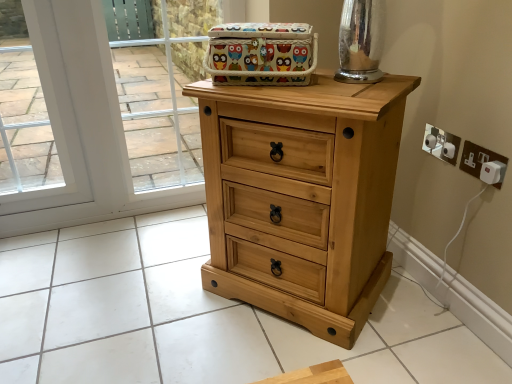
What is the approximate height of white plastic electrical outlet at right, which is counted as the second electric outlet, starting from the back?

white plastic electrical outlet at right, which is counted as the second electric outlet, starting from the back, is 3.96 inches tall.

What do you see at coordinates (305, 194) in the screenshot? I see `natural wood chest of drawers at center` at bounding box center [305, 194].

Where is `transparent glass door at upper left`? The width and height of the screenshot is (512, 384). transparent glass door at upper left is located at coordinates (81, 128).

Locate an element on the screen. The height and width of the screenshot is (384, 512). owl-patterned fabric basket at upper center is located at coordinates (261, 54).

Find the location of `white plastic electrical outlet at right, which is counted as the second electric outlet, starting from the back`. white plastic electrical outlet at right, which is counted as the second electric outlet, starting from the back is located at coordinates (482, 162).

Can you confirm if white plastic electrical outlet at right, positioned as the first electric outlet in front-to-back order, is thinner than owl-patterned fabric basket at upper center?

Yes.

Is white plastic electrical outlet at right, which is counted as the second electric outlet, starting from the back, facing away from owl-patterned fabric basket at upper center?

No.

Considering the relative sizes of white plastic electrical outlet at right, which is counted as the second electric outlet, starting from the back, and owl-patterned fabric basket at upper center in the image provided, is white plastic electrical outlet at right, which is counted as the second electric outlet, starting from the back, taller than owl-patterned fabric basket at upper center?

Incorrect, the height of white plastic electrical outlet at right, which is counted as the second electric outlet, starting from the back, is not larger of that of owl-patterned fabric basket at upper center.

Can you confirm if brushed metal knob at center, the 2th knob in the back-to-front sequence, is thinner than brushed metal knob at upper right, which appears as the first knob when viewed from the back?

Indeed, brushed metal knob at center, the 2th knob in the back-to-front sequence, has a lesser width compared to brushed metal knob at upper right, which appears as the first knob when viewed from the back.

From the image's perspective, is brushed metal knob at center, which ranks as the first knob in front-to-back order, located above or below brushed metal knob at upper right, which ranks as the second knob in front-to-back order?

Based on their image positions, brushed metal knob at center, which ranks as the first knob in front-to-back order, is located beneath brushed metal knob at upper right, which ranks as the second knob in front-to-back order.

Is brushed metal knob at center, the 2th knob in the back-to-front sequence, with brushed metal knob at upper right, which ranks as the second knob in front-to-back order?

Yes, brushed metal knob at center, the 2th knob in the back-to-front sequence, and brushed metal knob at upper right, which ranks as the second knob in front-to-back order, clearly make contact.

In the scene shown: In terms of size, does natural wood chest of drawers at center appear bigger or smaller than white plastic electric outlet at right, the 2th electric outlet viewed from the front?

natural wood chest of drawers at center is bigger than white plastic electric outlet at right, the 2th electric outlet viewed from the front.

Which is behind, point (228, 194) or point (458, 143)?

The point (458, 143) is behind.

Which of these two, natural wood chest of drawers at center or white plastic electric outlet at right, the 2th electric outlet viewed from the front, stands shorter?

white plastic electric outlet at right, the 2th electric outlet viewed from the front, is shorter.

From a real-world perspective, is natural wood chest of drawers at center physically above white plastic electric outlet at right, positioned as the first electric outlet in back-to-front order?

No, from a real-world perspective, natural wood chest of drawers at center is not on top of white plastic electric outlet at right, positioned as the first electric outlet in back-to-front order.

From the image's perspective, would you say transparent glass door at upper left is positioned over white plastic electrical outlet at right, positioned as the first electric outlet in front-to-back order?

Yes.

Relative to white plastic electrical outlet at right, positioned as the first electric outlet in front-to-back order, is transparent glass door at upper left in front or behind?

In the image, transparent glass door at upper left appears behind white plastic electrical outlet at right, positioned as the first electric outlet in front-to-back order.

Looking at the image, does transparent glass door at upper left seem bigger or smaller compared to white plastic electrical outlet at right, which is counted as the second electric outlet, starting from the back?

Clearly, transparent glass door at upper left is larger in size than white plastic electrical outlet at right, which is counted as the second electric outlet, starting from the back.

Is transparent glass door at upper left far from white plastic electrical outlet at right, which is counted as the second electric outlet, starting from the back?

Yes, transparent glass door at upper left and white plastic electrical outlet at right, which is counted as the second electric outlet, starting from the back, are quite far apart.

Looking at this image, can you tell me how much white plastic electric outlet at right, positioned as the first electric outlet in back-to-front order, and white plastic electrical outlet at right, positioned as the first electric outlet in front-to-back order, differ in facing direction?

They differ by 0.035 degrees in their facing directions.

Which point is more forward, (440, 145) or (467, 162)?

The point (440, 145) is more forward.

Which of these two, white plastic electric outlet at right, the 2th electric outlet viewed from the front, or white plastic electrical outlet at right, which is counted as the second electric outlet, starting from the back, is bigger?

white plastic electrical outlet at right, which is counted as the second electric outlet, starting from the back, is bigger.

Between white plastic electric outlet at right, the 2th electric outlet viewed from the front, and white plastic electrical outlet at right, positioned as the first electric outlet in front-to-back order, which one has less height?

white plastic electrical outlet at right, positioned as the first electric outlet in front-to-back order.

Consider the image. Is brushed metal knob at upper right, which appears as the first knob when viewed from the back, at the back of transparent glass door at upper left?

No, brushed metal knob at upper right, which appears as the first knob when viewed from the back, is not at the back of transparent glass door at upper left.

Find the location of a particular element. knob that is the 1st object located below the transparent glass door at upper left (from the image's perspective) is located at coordinates (430, 141).

Is brushed metal knob at upper right, which ranks as the second knob in front-to-back order, completely or partially inside transparent glass door at upper left?

Actually, brushed metal knob at upper right, which ranks as the second knob in front-to-back order, is outside transparent glass door at upper left.

Is transparent glass door at upper left not near brushed metal knob at upper right, which ranks as the second knob in front-to-back order?

Yes, transparent glass door at upper left and brushed metal knob at upper right, which ranks as the second knob in front-to-back order, are located far from each other.

Could you tell me if brushed metal knob at upper right, which appears as the first knob when viewed from the back, is facing natural wood chest of drawers at center?

Yes, brushed metal knob at upper right, which appears as the first knob when viewed from the back, faces towards natural wood chest of drawers at center.

Considering the sizes of objects brushed metal knob at upper right, which appears as the first knob when viewed from the back, and natural wood chest of drawers at center in the image provided, who is taller, brushed metal knob at upper right, which appears as the first knob when viewed from the back, or natural wood chest of drawers at center?

Standing taller between the two is natural wood chest of drawers at center.

Is brushed metal knob at upper right, which appears as the first knob when viewed from the back, located outside natural wood chest of drawers at center?

brushed metal knob at upper right, which appears as the first knob when viewed from the back, is positioned outside natural wood chest of drawers at center.

Considering the positions of objects brushed metal knob at upper right, which ranks as the second knob in front-to-back order, and natural wood chest of drawers at center in the image provided, who is in front, brushed metal knob at upper right, which ranks as the second knob in front-to-back order, or natural wood chest of drawers at center?

natural wood chest of drawers at center.

This screenshot has width=512, height=384. Find the location of `electric outlet that is the 2nd one when counting rightward from the owl-patterned fabric basket at upper center`. electric outlet that is the 2nd one when counting rightward from the owl-patterned fabric basket at upper center is located at coordinates (482, 162).

Locate an element on the screen. knob that is on the left side of brushed metal knob at center, the 2th knob in the back-to-front sequence is located at coordinates (430, 141).

Which object lies further to the anchor point brushed metal knob at upper right, which appears as the first knob when viewed from the back, transparent glass door at upper left or brushed metal knob at center, which ranks as the first knob in front-to-back order?

Based on the image, transparent glass door at upper left appears to be further to brushed metal knob at upper right, which appears as the first knob when viewed from the back.

Estimate the real-world distances between objects in this image. Which object is closer to transparent glass door at upper left, white plastic electrical outlet at right, positioned as the first electric outlet in front-to-back order, or brushed metal knob at center, which ranks as the first knob in front-to-back order?

brushed metal knob at center, which ranks as the first knob in front-to-back order, is closer to transparent glass door at upper left.

Considering their positions, is owl-patterned fabric basket at upper center positioned further to brushed metal knob at center, the 2th knob in the back-to-front sequence, than white plastic electric outlet at right, positioned as the first electric outlet in back-to-front order?

owl-patterned fabric basket at upper center is further to brushed metal knob at center, the 2th knob in the back-to-front sequence.

From the image, which object appears to be farther from brushed metal knob at upper right, which ranks as the second knob in front-to-back order, natural wood chest of drawers at center or owl-patterned fabric basket at upper center?

Among the two, owl-patterned fabric basket at upper center is located further to brushed metal knob at upper right, which ranks as the second knob in front-to-back order.

Considering their positions, is natural wood chest of drawers at center positioned further to transparent glass door at upper left than brushed metal knob at center, the 2th knob in the back-to-front sequence?

brushed metal knob at center, the 2th knob in the back-to-front sequence, is positioned further to the anchor transparent glass door at upper left.

Looking at the image, which one is located further to white plastic electrical outlet at right, which is counted as the second electric outlet, starting from the back, natural wood chest of drawers at center or transparent glass door at upper left?

transparent glass door at upper left is positioned further to the anchor white plastic electrical outlet at right, which is counted as the second electric outlet, starting from the back.

Estimate the real-world distances between objects in this image. Which object is further from brushed metal knob at center, the 2th knob in the back-to-front sequence, owl-patterned fabric basket at upper center or brushed metal knob at upper right, which ranks as the second knob in front-to-back order?

The object further to brushed metal knob at center, the 2th knob in the back-to-front sequence, is owl-patterned fabric basket at upper center.

Based on their spatial positions, is transparent glass door at upper left or owl-patterned fabric basket at upper center closer to brushed metal knob at upper right, which ranks as the second knob in front-to-back order?

The object closer to brushed metal knob at upper right, which ranks as the second knob in front-to-back order, is owl-patterned fabric basket at upper center.

Where is `electric outlet between transparent glass door at upper left and white plastic electrical outlet at right, which is counted as the second electric outlet, starting from the back, from left to right`? This screenshot has width=512, height=384. electric outlet between transparent glass door at upper left and white plastic electrical outlet at right, which is counted as the second electric outlet, starting from the back, from left to right is located at coordinates (441, 144).

Find the location of a particular element. The width and height of the screenshot is (512, 384). chest of drawers between transparent glass door at upper left and white plastic electrical outlet at right, positioned as the first electric outlet in front-to-back order is located at coordinates (305, 194).

Where is `the chest of drawers situated between owl-patterned fabric basket at upper center and brushed metal knob at upper right, which ranks as the second knob in front-to-back order, from left to right`? This screenshot has width=512, height=384. the chest of drawers situated between owl-patterned fabric basket at upper center and brushed metal knob at upper right, which ranks as the second knob in front-to-back order, from left to right is located at coordinates (305, 194).

Where is `knob located between transparent glass door at upper left and white plastic electric outlet at right, the 2th electric outlet viewed from the front, in the left-right direction`? knob located between transparent glass door at upper left and white plastic electric outlet at right, the 2th electric outlet viewed from the front, in the left-right direction is located at coordinates (430, 141).